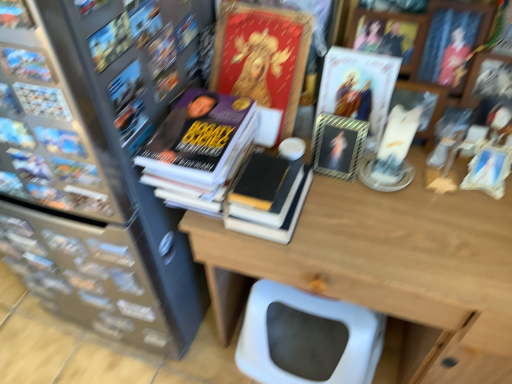
The height and width of the screenshot is (384, 512). I want to click on free space in front of metallic silver frame at upper center, positioned as the 2th book cover in left-to-right order, so click(x=355, y=228).